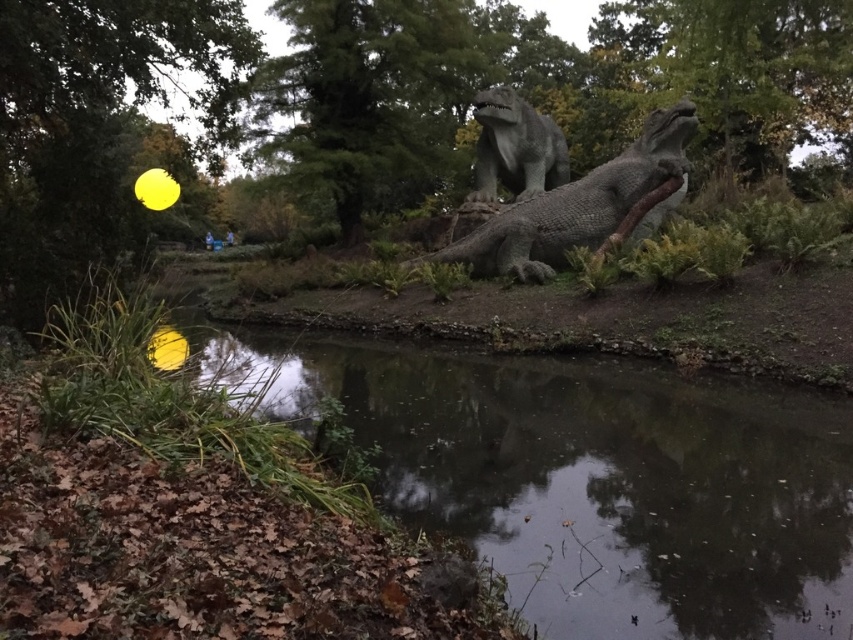
Does point (773, 563) come farther from viewer compared to point (558, 148)?

No.

Does dark reflective water at center have a greater height compared to gray textured statue at center?

No, dark reflective water at center is not taller than gray textured statue at center.

Describe the element at coordinates (587, 477) in the screenshot. I see `dark reflective water at center` at that location.

At what (x,y) coordinates should I click in order to perform the action: click on dark reflective water at center. Please return your answer as a coordinate pair (x, y). Looking at the image, I should click on (587, 477).

What do you see at coordinates (581, 205) in the screenshot? The height and width of the screenshot is (640, 853). I see `gray stone dinosaur at center` at bounding box center [581, 205].

Looking at this image, does gray stone dinosaur at center have a lesser height compared to gray textured statue at center?

No, gray stone dinosaur at center is not shorter than gray textured statue at center.

What do you see at coordinates (581, 205) in the screenshot?
I see `gray stone dinosaur at center` at bounding box center [581, 205].

Where is `gray stone dinosaur at center`? gray stone dinosaur at center is located at coordinates (581, 205).

Is dark reflective water at center to the left of gray stone dinosaur at center from the viewer's perspective?

Correct, you'll find dark reflective water at center to the left of gray stone dinosaur at center.

Can you confirm if dark reflective water at center is smaller than gray stone dinosaur at center?

Actually, dark reflective water at center might be larger than gray stone dinosaur at center.

What do you see at coordinates (587, 477) in the screenshot? I see `dark reflective water at center` at bounding box center [587, 477].

The height and width of the screenshot is (640, 853). Find the location of `dark reflective water at center`. dark reflective water at center is located at coordinates (587, 477).